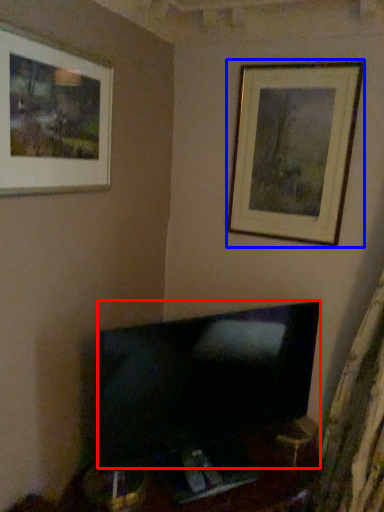
Question: Which object appears closest to the camera in this image, television (highlighted by a red box) or picture frame (highlighted by a blue box)?

Choices:
 (A) television
 (B) picture frame

Answer: (A)